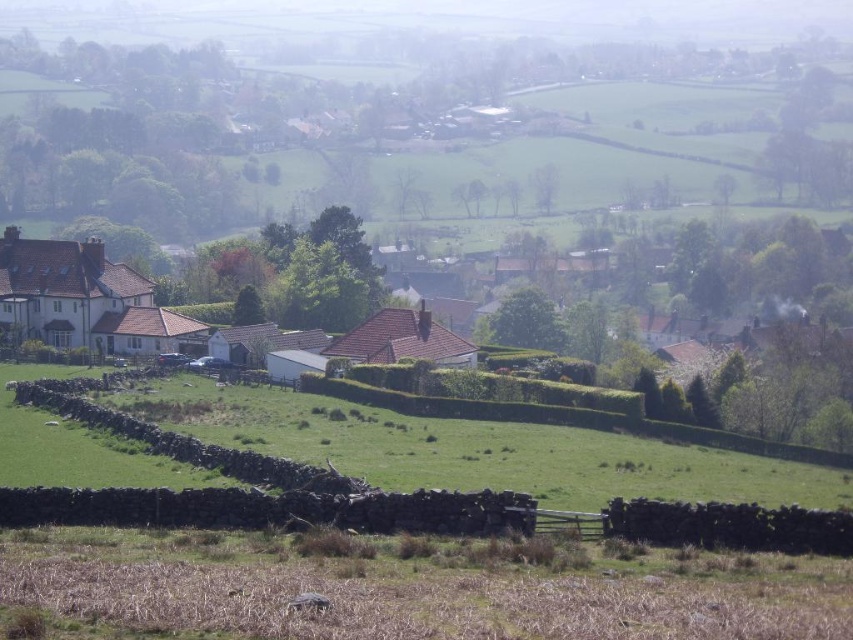
Does green grassy field at lower center have a smaller size compared to white matte house at center?

Indeed, green grassy field at lower center has a smaller size compared to white matte house at center.

Can you confirm if green grassy field at lower center is positioned to the right of white matte house at center?

In fact, green grassy field at lower center is to the left of white matte house at center.

Locate an element on the screen. This screenshot has width=853, height=640. green grassy field at lower center is located at coordinates (473, 449).

Find the location of a particular element. green grassy field at lower center is located at coordinates (473, 449).